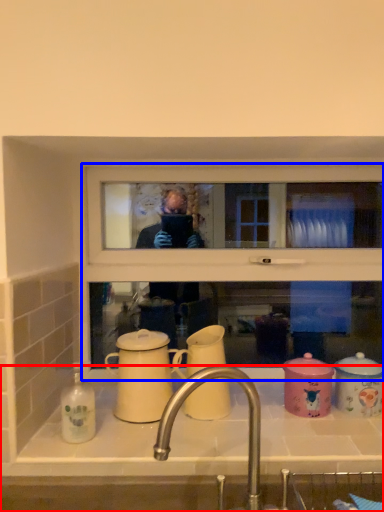
Question: Which point is further to the camera, sink (highlighted by a red box) or window frame (highlighted by a blue box)?

Choices:
 (A) sink
 (B) window frame

Answer: (B)